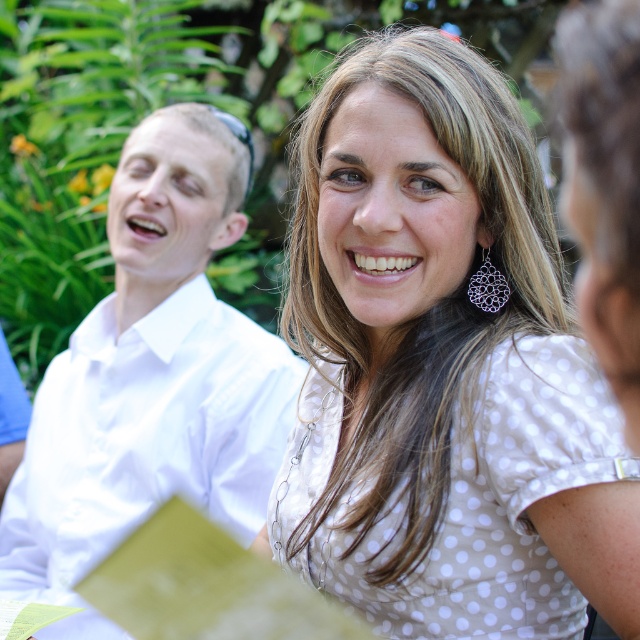
Is white dotted shirt at center shorter than black textured earring at upper right?

Incorrect, white dotted shirt at center's height does not fall short of black textured earring at upper right's.

Does white dotted shirt at center lie in front of black textured earring at upper right?

Yes, white dotted shirt at center is in front of black textured earring at upper right.

Does point (305, 256) come closer to viewer compared to point (484, 280)?

No, (305, 256) is behind (484, 280).

Locate an element on the screen. white dotted shirt at center is located at coordinates (442, 369).

Who is positioned more to the right, white smooth shirt at left or black textured earring at upper right?

black textured earring at upper right

Who is lower down, white smooth shirt at left or black textured earring at upper right?

Positioned lower is white smooth shirt at left.

Between point (236, 195) and point (508, 289), which one is positioned behind?

Point (236, 195)

Find the location of a particular element. The width and height of the screenshot is (640, 640). white smooth shirt at left is located at coordinates (152, 372).

Can you confirm if white dotted shirt at center is taller than white smooth shirt at left?

Incorrect, white dotted shirt at center's height is not larger of white smooth shirt at left's.

Locate an element on the screen. The width and height of the screenshot is (640, 640). white dotted shirt at center is located at coordinates point(442,369).